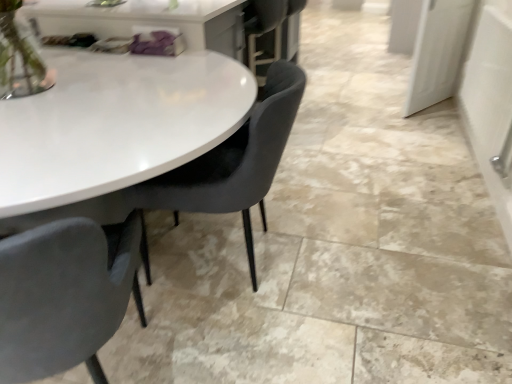
Question: Does matte black chair at center, placed as the first chair when sorted from right to left, have a lesser width compared to velvet grey chair at center, which is the 2th chair from right to left?

Choices:
 (A) no
 (B) yes

Answer: (A)

Question: Can velvet grey chair at center, which is the 2th chair from right to left, be found inside matte black chair at center, placed as the first chair when sorted from right to left?

Choices:
 (A) no
 (B) yes

Answer: (A)

Question: From a real-world perspective, does matte black chair at center, acting as the 2th chair starting from the left, stand above velvet grey chair at center, which is the 2th chair from right to left?

Choices:
 (A) yes
 (B) no

Answer: (B)

Question: Is matte black chair at center, placed as the first chair when sorted from right to left, to the right of velvet grey chair at center, the first chair when ordered from left to right, from the viewer's perspective?

Choices:
 (A) yes
 (B) no

Answer: (A)

Question: Is the depth of matte black chair at center, placed as the first chair when sorted from right to left, greater than that of velvet grey chair at center, which is the 2th chair from right to left?

Choices:
 (A) yes
 (B) no

Answer: (A)

Question: Is white glossy door at upper right wider or thinner than velvet grey chair at center, the first chair when ordered from left to right?

Choices:
 (A) wide
 (B) thin

Answer: (B)

Question: Is white glossy door at upper right in front of or behind velvet grey chair at center, the first chair when ordered from left to right, in the image?

Choices:
 (A) front
 (B) behind

Answer: (B)

Question: Is white glossy door at upper right bigger or smaller than velvet grey chair at center, which is the 2th chair from right to left?

Choices:
 (A) big
 (B) small

Answer: (B)

Question: Considering the positions of point (446, 6) and point (139, 235), is point (446, 6) closer or farther from the camera than point (139, 235)?

Choices:
 (A) closer
 (B) farther

Answer: (B)

Question: From a real-world perspective, relative to velvet grey chair at center, the first chair when ordered from left to right, is matte black chair at center, placed as the first chair when sorted from right to left, vertically above or below?

Choices:
 (A) below
 (B) above

Answer: (A)

Question: Is matte black chair at center, placed as the first chair when sorted from right to left, inside or outside of velvet grey chair at center, which is the 2th chair from right to left?

Choices:
 (A) outside
 (B) inside

Answer: (A)

Question: Considering the positions of matte black chair at center, placed as the first chair when sorted from right to left, and velvet grey chair at center, the first chair when ordered from left to right, in the image, is matte black chair at center, placed as the first chair when sorted from right to left, taller or shorter than velvet grey chair at center, the first chair when ordered from left to right,?

Choices:
 (A) short
 (B) tall

Answer: (A)

Question: Considering the positions of matte black chair at center, placed as the first chair when sorted from right to left, and velvet grey chair at center, which is the 2th chair from right to left, in the image, is matte black chair at center, placed as the first chair when sorted from right to left, bigger or smaller than velvet grey chair at center, which is the 2th chair from right to left,?

Choices:
 (A) small
 (B) big

Answer: (A)

Question: Which is correct: velvet grey chair at center, the first chair when ordered from left to right, is inside white glossy door at upper right, or outside of it?

Choices:
 (A) outside
 (B) inside

Answer: (A)

Question: Visually, is velvet grey chair at center, the first chair when ordered from left to right, positioned to the left or to the right of white glossy door at upper right?

Choices:
 (A) left
 (B) right

Answer: (A)